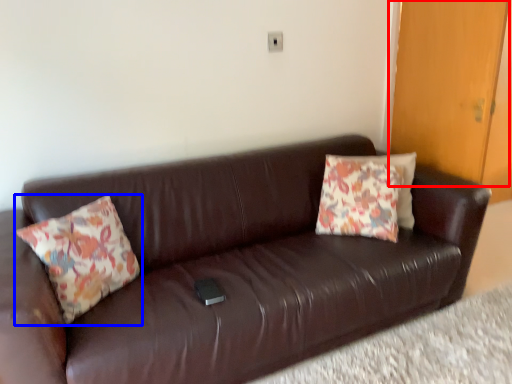
Question: Which point is closer to the camera, door (highlighted by a red box) or pillow (highlighted by a blue box)?

Choices:
 (A) door
 (B) pillow

Answer: (B)